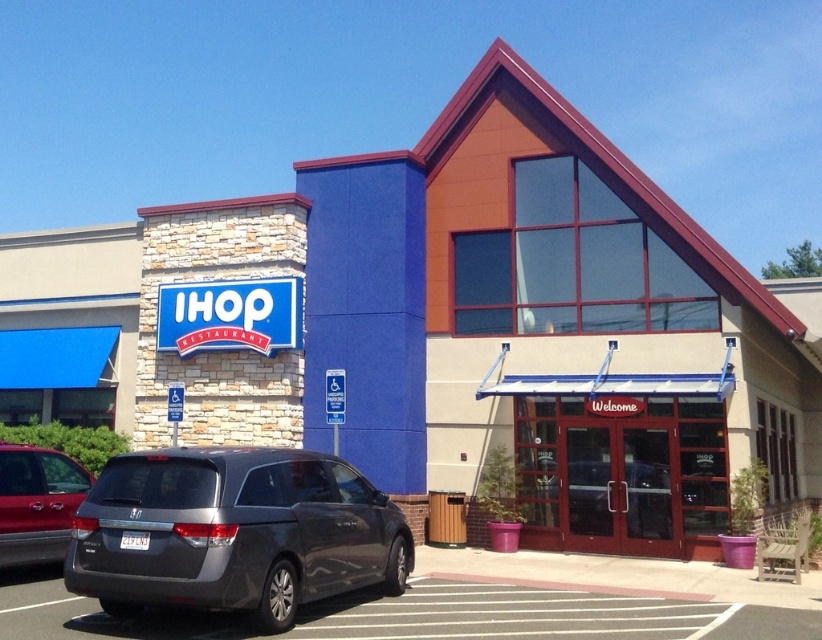
You are a delivery driver approaching the IHOP restaurant. You need to park your metallic silver minivan at left in the gray asphalt parking lot at lower left. Can you drive directly into the parking lot from your current position?

The gray asphalt parking lot at lower left is in front of the metallic silver minivan at left, so the minivan is blocking the path to the parking lot. You will need to move the minivan first before driving into the parking lot.

You are standing at the entrance of the IHOP restaurant and see a point marked at coordinate (234, 532). What object is located at that point?

The point at coordinate (234, 532) indicates the location of the satin gray minivan at lower left.

You are a delivery driver who needs to park your 2.5 meter wide truck in the parking lot near the IHOP entrance. There are two minivans present. Which minivan, the satin gray minivan at lower left or the metallic silver minivan at left, is wider and thus might block your path if parked too close?

The satin gray minivan at lower left might be wider than metallic silver minivan at left, so it could potentially block your path if parked too close.